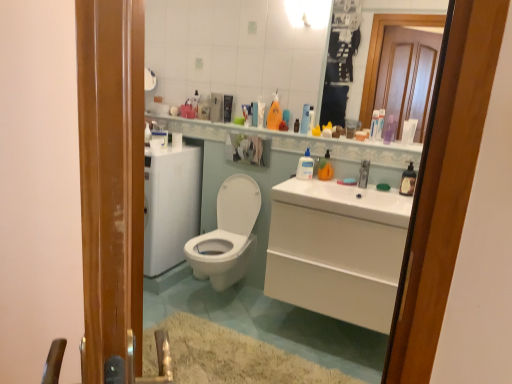
What are the coordinates of `vacant space situated on the left part of translucent plastic bottle at right, the 4th cleaning product viewed from the back` in the screenshot? It's located at (385, 193).